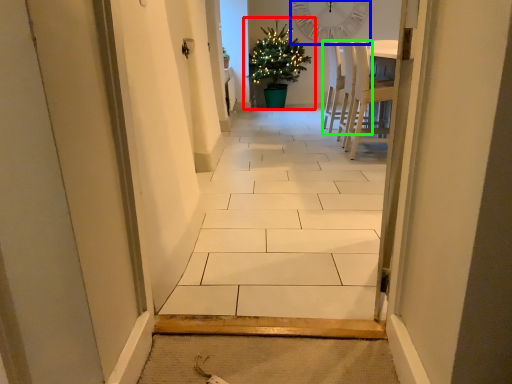
Question: Based on their relative distances, which object is farther from houseplant (highlighted by a red box)? Choose from clock (highlighted by a blue box) and chair (highlighted by a green box).

Choices:
 (A) clock
 (B) chair

Answer: (B)